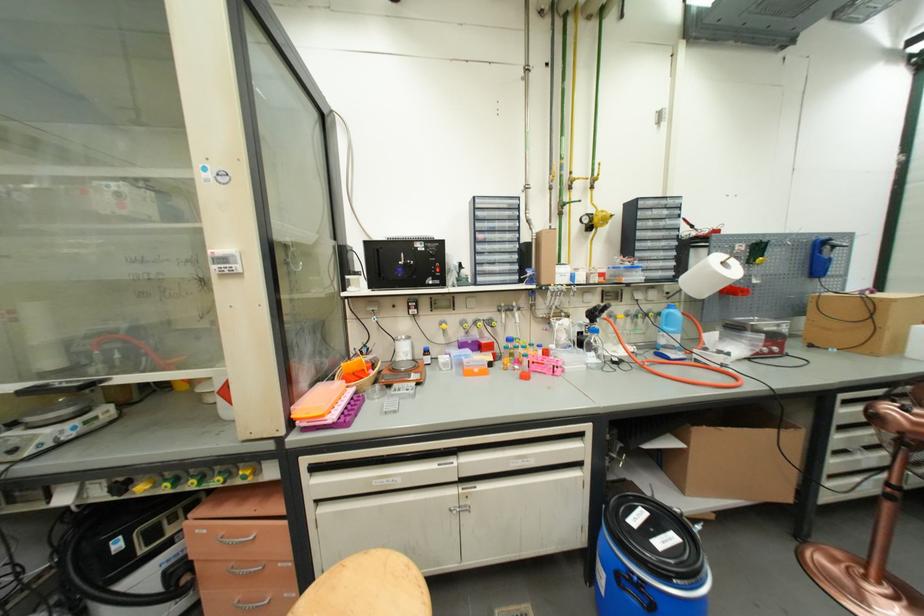
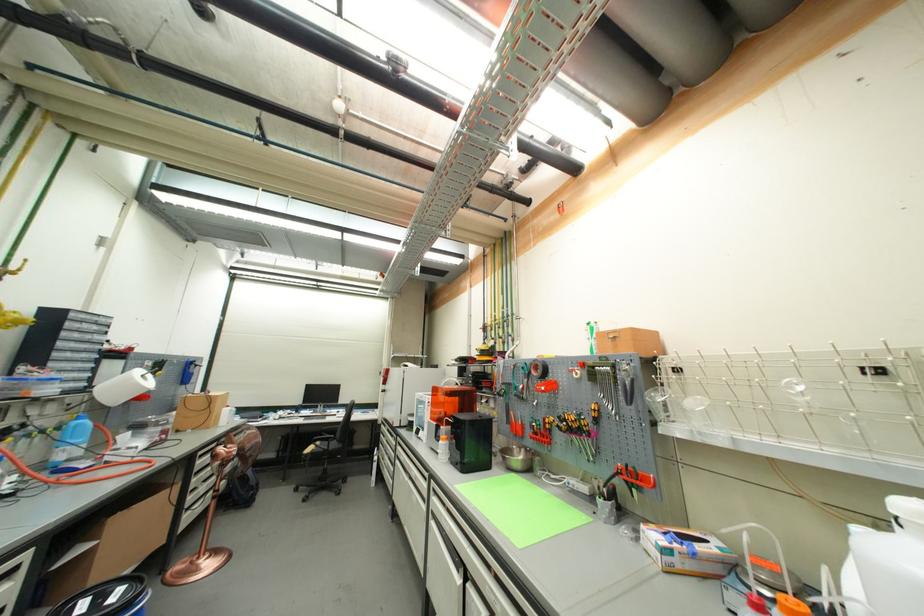
Where in the second image is the point corresponding to point (708, 428) from the first image?

(123, 515)